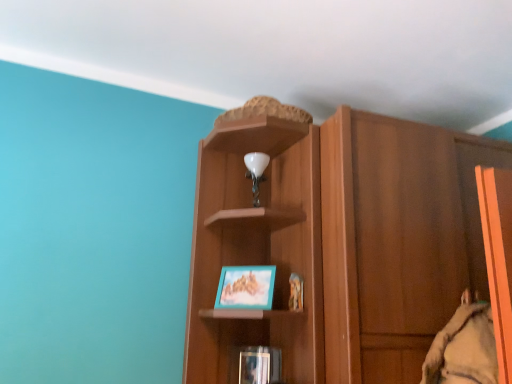
Question: Does wooden cupboard at center have a lesser width compared to matte black book at lower center?

Choices:
 (A) no
 (B) yes

Answer: (A)

Question: Is wooden cupboard at center in contact with matte black book at lower center?

Choices:
 (A) yes
 (B) no

Answer: (B)

Question: Can you confirm if wooden cupboard at center is smaller than matte black book at lower center?

Choices:
 (A) no
 (B) yes

Answer: (A)

Question: Can you confirm if wooden cupboard at center is taller than matte black book at lower center?

Choices:
 (A) yes
 (B) no

Answer: (A)

Question: Is wooden cupboard at center to the left of matte black book at lower center from the viewer's perspective?

Choices:
 (A) no
 (B) yes

Answer: (A)

Question: Considering the positions of point pyautogui.click(x=236, y=299) and point pyautogui.click(x=248, y=354), is point pyautogui.click(x=236, y=299) closer or farther from the camera than point pyautogui.click(x=248, y=354)?

Choices:
 (A) farther
 (B) closer

Answer: (B)

Question: From the image's perspective, is teal matte picture frame at center above or below matte black book at lower center?

Choices:
 (A) below
 (B) above

Answer: (B)

Question: Considering the positions of teal matte picture frame at center and matte black book at lower center in the image, is teal matte picture frame at center wider or thinner than matte black book at lower center?

Choices:
 (A) thin
 (B) wide

Answer: (B)

Question: Based on their sizes in the image, would you say teal matte picture frame at center is bigger or smaller than matte black book at lower center?

Choices:
 (A) big
 (B) small

Answer: (A)

Question: From the image's perspective, relative to teal matte picture frame at center, is wooden cupboard at center above or below?

Choices:
 (A) above
 (B) below

Answer: (A)

Question: Considering the positions of wooden cupboard at center and teal matte picture frame at center in the image, is wooden cupboard at center bigger or smaller than teal matte picture frame at center?

Choices:
 (A) small
 (B) big

Answer: (B)

Question: Is wooden cupboard at center situated inside teal matte picture frame at center or outside?

Choices:
 (A) inside
 (B) outside

Answer: (B)

Question: From their relative heights in the image, would you say wooden cupboard at center is taller or shorter than teal matte picture frame at center?

Choices:
 (A) short
 (B) tall

Answer: (B)

Question: Is teal matte picture frame at center bigger or smaller than wooden cupboard at center?

Choices:
 (A) big
 (B) small

Answer: (B)

Question: Is teal matte picture frame at center inside or outside of wooden cupboard at center?

Choices:
 (A) outside
 (B) inside

Answer: (A)